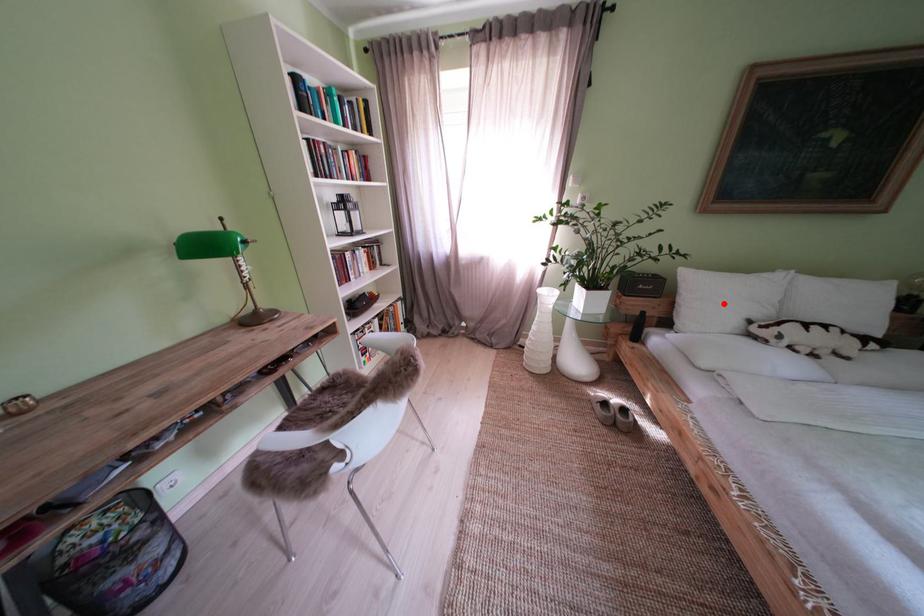
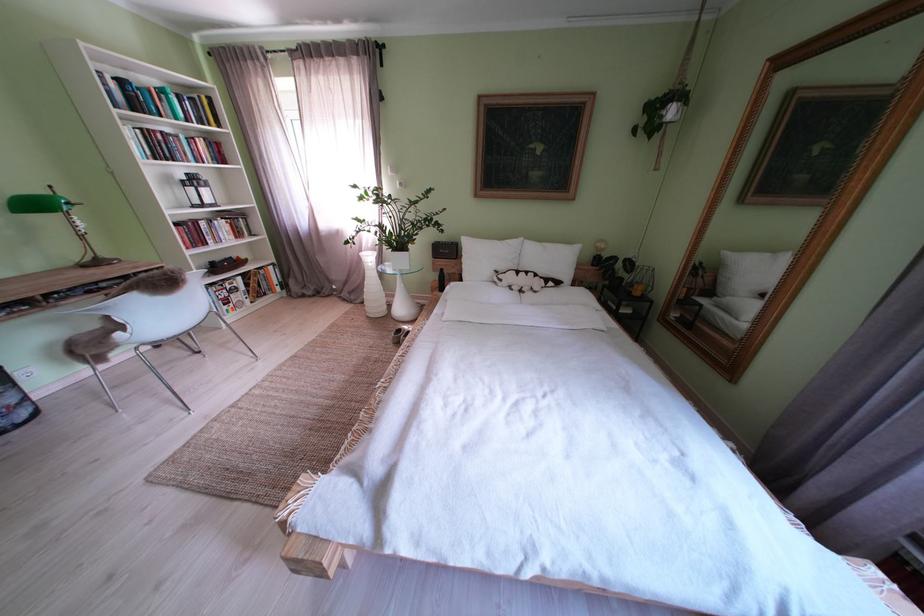
Find the pixel in the second image that matches the highlighted location in the first image.

(490, 262)